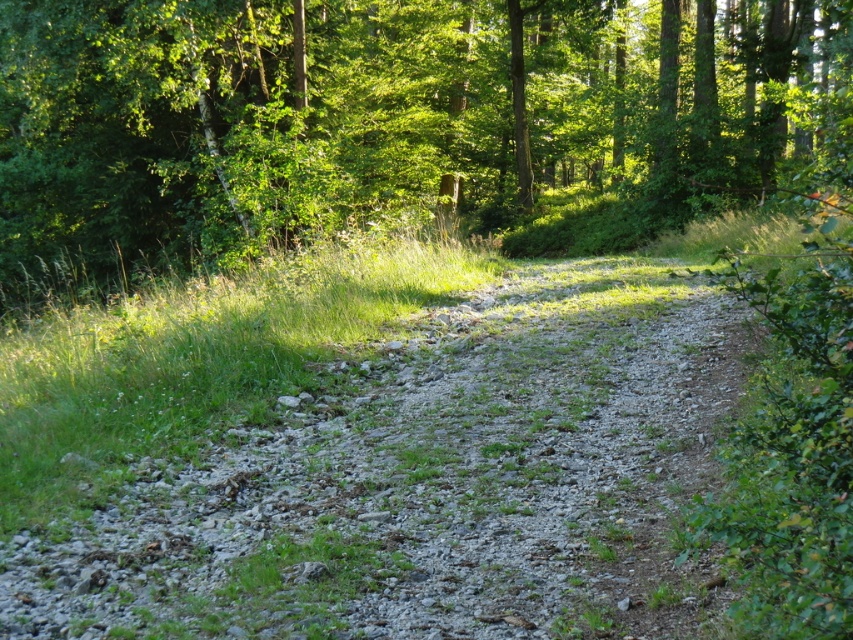
Question: Can you confirm if green leafy tree at upper center is bigger than gray gravel path at center?

Choices:
 (A) yes
 (B) no

Answer: (A)

Question: Does green leafy tree at upper center have a greater width compared to gray gravel path at center?

Choices:
 (A) no
 (B) yes

Answer: (B)

Question: Which point is closer to the camera?

Choices:
 (A) green leafy tree at upper center
 (B) gray gravel path at center

Answer: (B)

Question: Which point appears closest to the camera in this image?

Choices:
 (A) (802, 35)
 (B) (426, 438)

Answer: (B)

Question: Does green leafy tree at upper center appear on the left side of gray gravel path at center?

Choices:
 (A) yes
 (B) no

Answer: (B)